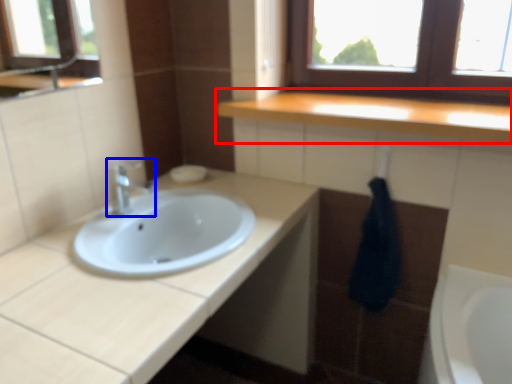
Question: Which object appears farthest to the camera in this image, countertop (highlighted by a red box) or tap (highlighted by a blue box)?

Choices:
 (A) countertop
 (B) tap

Answer: (B)